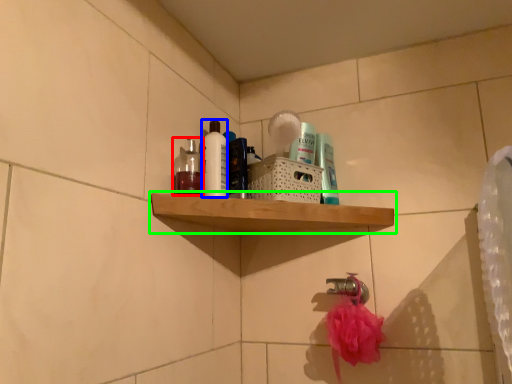
Question: Which object is the closest to the mouthwash (highlighted by a red box)? Choose among these: cleaning product (highlighted by a blue box) or shelf (highlighted by a green box).

Choices:
 (A) cleaning product
 (B) shelf

Answer: (A)